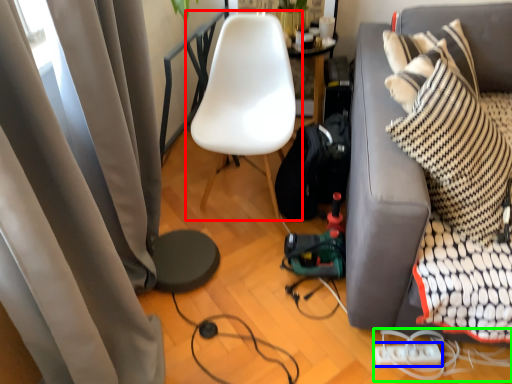
Question: Which is farther away from chair (highlighted by a red box)? extension cord (highlighted by a blue box) or cable (highlighted by a green box)?

Choices:
 (A) extension cord
 (B) cable

Answer: (A)